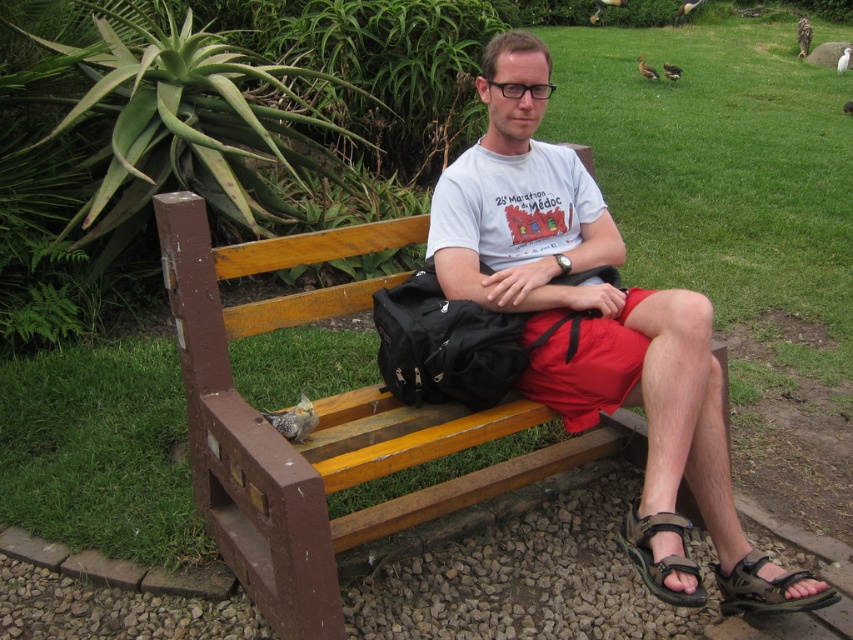
Looking at this image, can you confirm if white cotton t-shirt at center is taller than wooden bench at center?

Correct, white cotton t-shirt at center is much taller as wooden bench at center.

Can you confirm if white cotton t-shirt at center is positioned above wooden bench at center?

Indeed, white cotton t-shirt at center is positioned over wooden bench at center.

The width and height of the screenshot is (853, 640). Find the location of `white cotton t-shirt at center`. white cotton t-shirt at center is located at coordinates (581, 292).

Which is behind, point (517, 49) or point (422, 284)?

Point (422, 284)

Which of these two, white cotton t-shirt at center or black fabric bag at center, stands taller?

white cotton t-shirt at center is taller.

Is point (663, 403) less distant than point (424, 387)?

Yes.

Where is `white cotton t-shirt at center`? This screenshot has height=640, width=853. white cotton t-shirt at center is located at coordinates (581, 292).

Is white cotton t-shirt at center further to the viewer compared to brown leather sandal at lower right?

No, it is in front of brown leather sandal at lower right.

The image size is (853, 640). Describe the element at coordinates (581, 292) in the screenshot. I see `white cotton t-shirt at center` at that location.

Is point (502, 291) less distant than point (756, 573)?

That is False.

Identify the location of white cotton t-shirt at center. (581, 292).